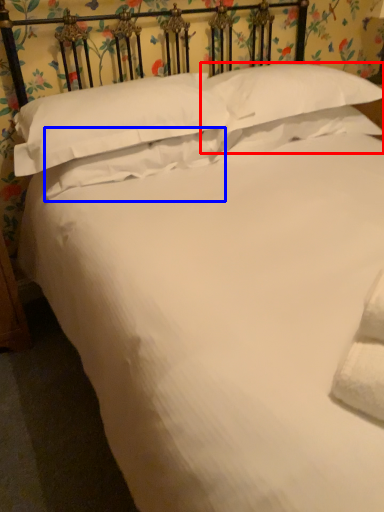
Question: Which point is further to the camera, pillow (highlighted by a red box) or pillow (highlighted by a blue box)?

Choices:
 (A) pillow
 (B) pillow

Answer: (A)